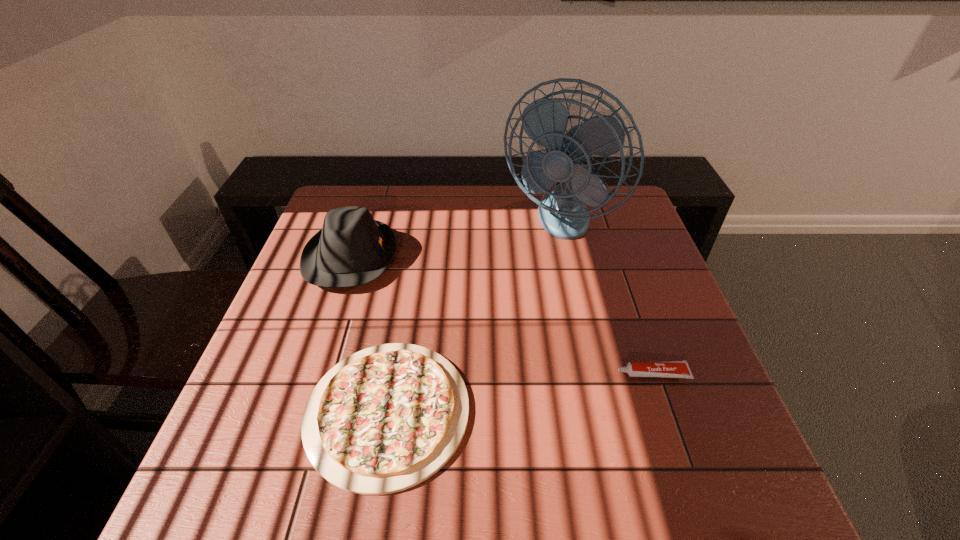
What are the coordinates of `fan` in the screenshot? It's located at (562, 212).

Locate an element on the screen. This screenshot has height=540, width=960. fedora is located at coordinates (352, 249).

Identify the location of toothpaste. This screenshot has height=540, width=960. (669, 369).

Image resolution: width=960 pixels, height=540 pixels. Identify the location of pizza. (385, 419).

Identify the location of blank space located 0.190m in front of the fan to blow air. The image size is (960, 540). tap(573, 308).

The image size is (960, 540). I want to click on free location located on the front-facing side of the fedora, so click(505, 257).

This screenshot has height=540, width=960. In order to click on free space located 0.200m at the nozzle of the toothpaste in this screenshot , I will do `click(524, 374)`.

This screenshot has height=540, width=960. Find the location of `vacant space located 0.120m at the nozzle of the toothpaste`. vacant space located 0.120m at the nozzle of the toothpaste is located at coordinates (562, 374).

At what (x,y) coordinates should I click in order to perform the action: click on free space located 0.400m at the nozzle of the toothpaste. Please return your answer as a coordinate pair (x, y). This screenshot has width=960, height=540. Looking at the image, I should click on (430, 374).

Where is `free spot located on the back of the pizza`? free spot located on the back of the pizza is located at coordinates (415, 253).